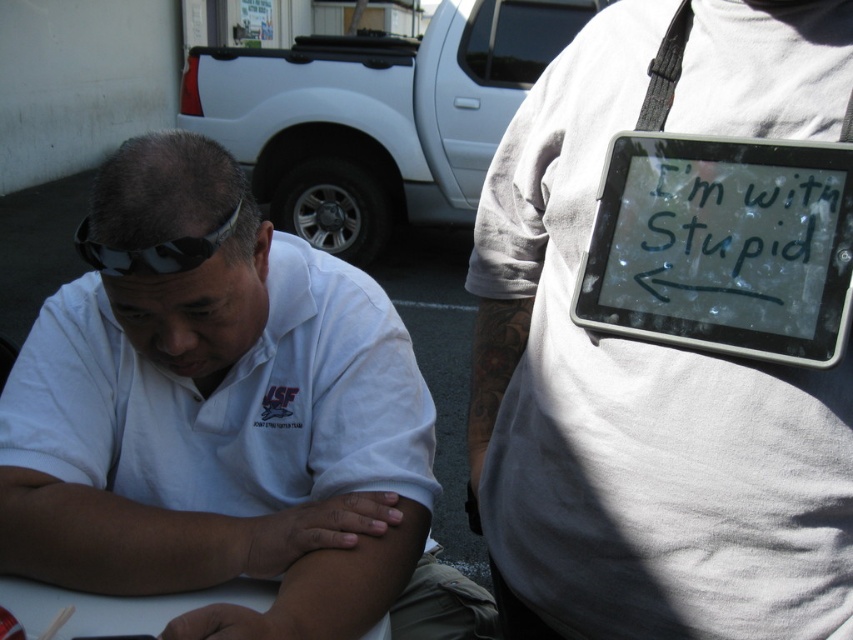
You are a photographer at an outdoor event and need to access your equipment. You see a clear plastic tablet at upper right and camouflage fabric goggles at upper left. Which item is positioned lower in the image?

The clear plastic tablet at upper right is below camouflage fabric goggles at upper left, so the clear plastic tablet at upper right is positioned lower in the image.